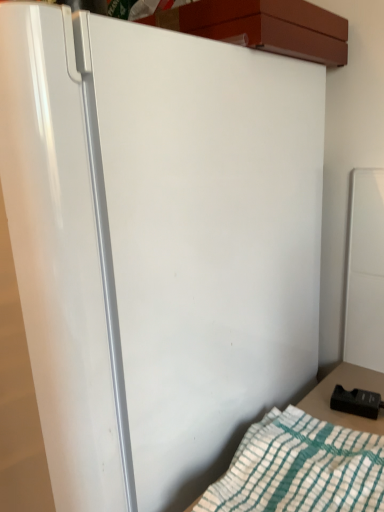
Describe the element at coordinates (300, 468) in the screenshot. I see `white cotton blanket at lower right` at that location.

Find the location of `white cotton blanket at lower right`. white cotton blanket at lower right is located at coordinates (300, 468).

Where is `black plastic remote control at lower right`? black plastic remote control at lower right is located at coordinates (349, 390).

What do you see at coordinates (349, 390) in the screenshot? I see `black plastic remote control at lower right` at bounding box center [349, 390].

What are the coordinates of `white cotton blanket at lower right` in the screenshot? It's located at (300, 468).

Which object is positioned more to the right, white cotton blanket at lower right or black plastic remote control at lower right?

black plastic remote control at lower right.

Considering the positions of objects white cotton blanket at lower right and black plastic remote control at lower right in the image provided, who is behind, white cotton blanket at lower right or black plastic remote control at lower right?

black plastic remote control at lower right is behind.

Does point (276, 497) come closer to viewer compared to point (368, 386)?

Yes, point (276, 497) is closer to viewer.

From the image's perspective, which is above, white cotton blanket at lower right or black plastic remote control at lower right?

black plastic remote control at lower right, from the image's perspective.

From a real-world perspective, does white cotton blanket at lower right sit lower than black plastic remote control at lower right?

Incorrect, from a real-world perspective, white cotton blanket at lower right is higher than black plastic remote control at lower right.

Does white cotton blanket at lower right have a lesser width compared to black plastic remote control at lower right?

No, white cotton blanket at lower right is not thinner than black plastic remote control at lower right.

Considering the sizes of objects white cotton blanket at lower right and black plastic remote control at lower right in the image provided, who is shorter, white cotton blanket at lower right or black plastic remote control at lower right?

white cotton blanket at lower right.

Considering the relative sizes of white cotton blanket at lower right and black plastic remote control at lower right in the image provided, is white cotton blanket at lower right bigger than black plastic remote control at lower right?

Correct, white cotton blanket at lower right is larger in size than black plastic remote control at lower right.

Looking at this image, is white cotton blanket at lower right completely or partially outside of black plastic remote control at lower right?

That's correct, white cotton blanket at lower right is outside of black plastic remote control at lower right.

Is white cotton blanket at lower right with black plastic remote control at lower right?

No, white cotton blanket at lower right is not touching black plastic remote control at lower right.

Could you tell me if white cotton blanket at lower right is facing black plastic remote control at lower right?

No, white cotton blanket at lower right is not aimed at black plastic remote control at lower right.

At what (x,y) coordinates should I click in order to perform the action: click on table behind the white cotton blanket at lower right. Please return your answer as a coordinate pair (x, y). The image size is (384, 512). Looking at the image, I should click on (349, 390).

Based on the photo, visually, is black plastic remote control at lower right positioned to the left or to the right of white cotton blanket at lower right?

black plastic remote control at lower right is positioned on white cotton blanket at lower right's right side.

Which object is further away from the camera, black plastic remote control at lower right or white cotton blanket at lower right?

black plastic remote control at lower right is more distant.

Does point (312, 406) come closer to viewer compared to point (322, 473)?

No, it is behind (322, 473).

From the image's perspective, is black plastic remote control at lower right located above white cotton blanket at lower right?

Yes, from the image's perspective, black plastic remote control at lower right is above white cotton blanket at lower right.

From a real-world perspective, is black plastic remote control at lower right physically located above or below white cotton blanket at lower right?

From a real-world perspective, black plastic remote control at lower right is physically below white cotton blanket at lower right.

Looking at this image, which object is thinner, black plastic remote control at lower right or white cotton blanket at lower right?

black plastic remote control at lower right is thinner.

Considering the sizes of objects black plastic remote control at lower right and white cotton blanket at lower right in the image provided, who is taller, black plastic remote control at lower right or white cotton blanket at lower right?

black plastic remote control at lower right.

Which of these two, black plastic remote control at lower right or white cotton blanket at lower right, is smaller?

With smaller size is black plastic remote control at lower right.

Do you think black plastic remote control at lower right is within white cotton blanket at lower right, or outside of it?

black plastic remote control at lower right cannot be found inside white cotton blanket at lower right.

Is black plastic remote control at lower right next to white cotton blanket at lower right?

No, black plastic remote control at lower right is not beside white cotton blanket at lower right.

Is black plastic remote control at lower right looking in the opposite direction of white cotton blanket at lower right?

No, black plastic remote control at lower right is not facing the opposite direction of white cotton blanket at lower right.

How different are the orientations of black plastic remote control at lower right and white cotton blanket at lower right in degrees?

6.09 degrees separate the facing orientations of black plastic remote control at lower right and white cotton blanket at lower right.

Identify the location of table that is under the white cotton blanket at lower right (from a real-world perspective). (349, 390).

Locate an element on the screen. Image resolution: width=384 pixels, height=512 pixels. table behind the white cotton blanket at lower right is located at coordinates (349, 390).

You are a GUI agent. You are given a task and a screenshot of the screen. Output one action in this format:
    pyautogui.click(x=<x>, y=<y>)
    Task: Click on the table that appears on the right of white cotton blanket at lower right
    This screenshot has height=512, width=384.
    Given the screenshot: What is the action you would take?
    pyautogui.click(x=349, y=390)